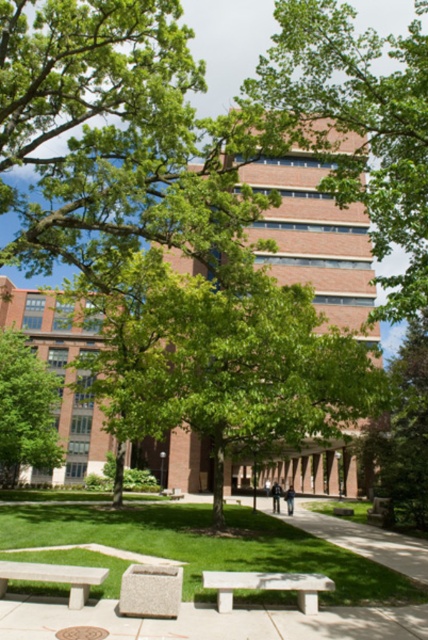
Measure the distance between green grass at lower center and white concrete bench at center.

green grass at lower center is 4.41 meters from white concrete bench at center.

Is green grass at lower center bigger than white concrete bench at center?

Yes, green grass at lower center is bigger than white concrete bench at center.

Which is behind, point (11, 508) or point (238, 586)?

Point (11, 508)

Identify the location of green grass at lower center. (211, 547).

Where is `white concrete bench at lower center`? white concrete bench at lower center is located at coordinates (211, 621).

Locate an element on the screen. This screenshot has height=640, width=428. white concrete bench at lower center is located at coordinates (211, 621).

Identify the location of white concrete bench at lower center. This screenshot has width=428, height=640. [211, 621].

How much distance is there between green leafy tree at center and granite bench at center?

A distance of 38.77 feet exists between green leafy tree at center and granite bench at center.

Between green leafy tree at center and granite bench at center, which one is positioned higher?

granite bench at center is above.

Is point (204, 390) in front of point (178, 572)?

No, it is not.

Where is `green leafy tree at center`? The width and height of the screenshot is (428, 640). green leafy tree at center is located at coordinates (219, 358).